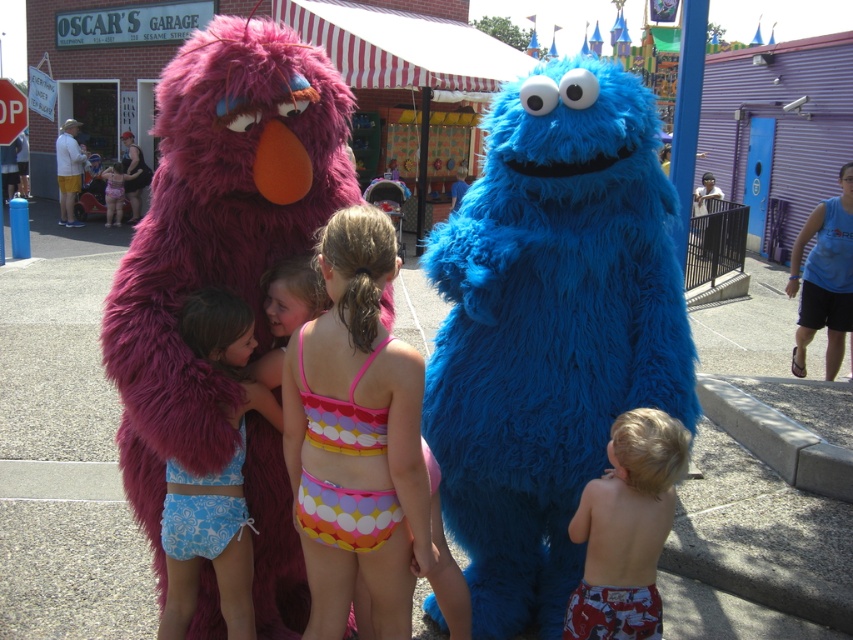
You are a visitor at the event and want to take a photo of the fuzzy purple monster at center without the red metal stop sign at upper left appearing in the frame. How should you adjust your camera angle?

Since the fuzzy purple monster at center is located below the red metal stop sign at upper left, you can lower your camera angle to position the stop sign above the frame while keeping the fuzzy purple monster at center in view.

You are a visitor at the event and want to take a photo of the fuzzy purple monster at center without including the red metal stop sign at upper left in the frame. Based on their positions, is this possible?

The fuzzy purple monster at center is to the right of the red metal stop sign at upper left, so if you position yourself to the right side of the scene, you can capture the fuzzy purple monster at center while excluding the red metal stop sign at upper left from the frame.